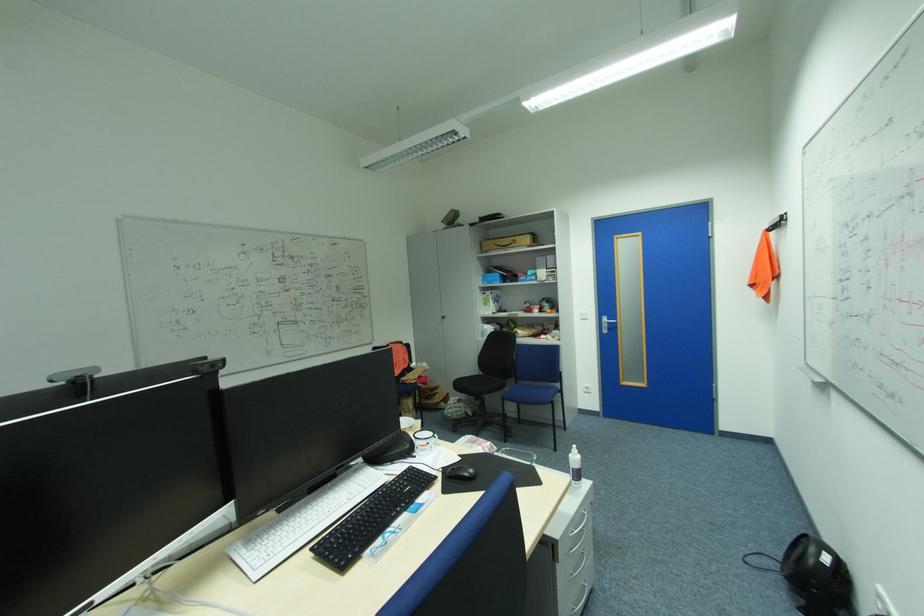
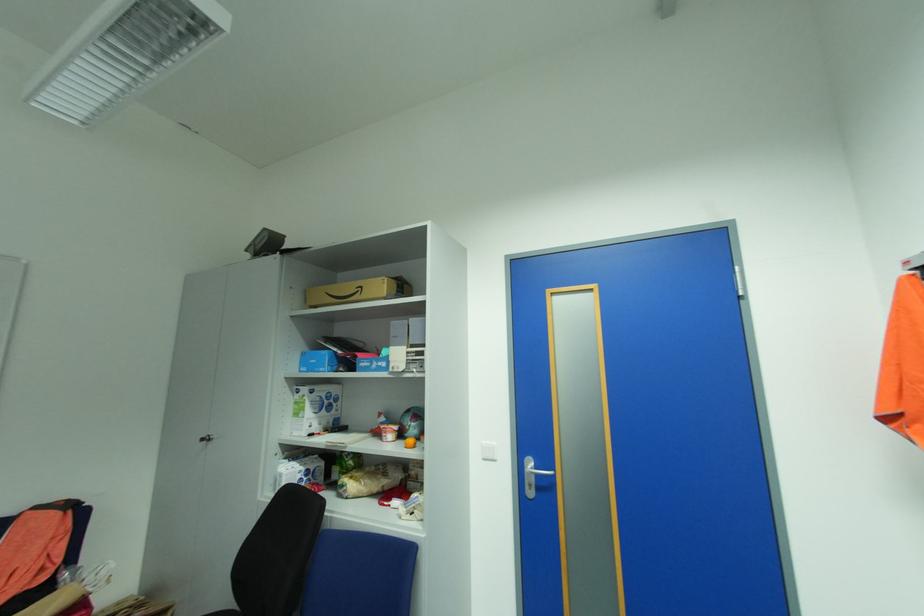
Find the pixel in the second image that matches (614,323) in the first image.

(543, 475)